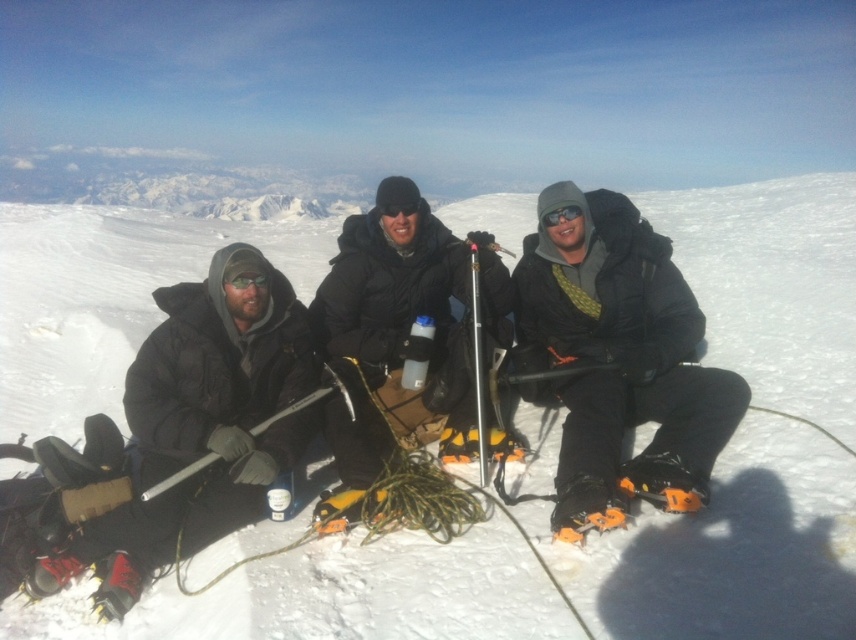
What do you see at coordinates (727, 548) in the screenshot?
I see `white powder snow at center` at bounding box center [727, 548].

Which is below, white powder snow at center or matte black jacket at center?

matte black jacket at center is lower down.

Where is `white powder snow at center`? This screenshot has width=856, height=640. white powder snow at center is located at coordinates (727, 548).

Find the location of a particular element. The height and width of the screenshot is (640, 856). white powder snow at center is located at coordinates (727, 548).